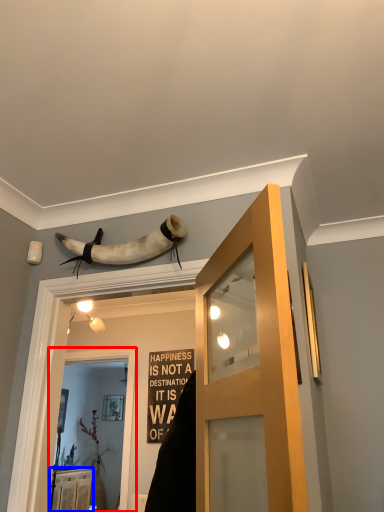
Question: Which of the following is the closest to the observer, screen door (highlighted by a red box) or cabinetry (highlighted by a blue box)?

Choices:
 (A) screen door
 (B) cabinetry

Answer: (A)